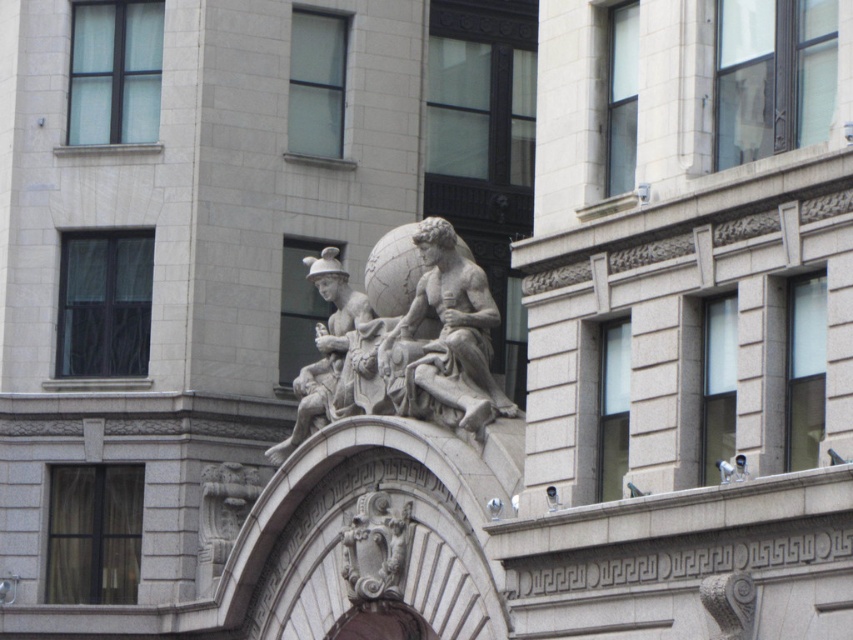
You are an architect analyzing the symmetry of the classical building. The stone statue at center is placed at coordinates. Is the statue positioned exactly at the center of the building facade?

The stone statue at center is located at coordinates point (x=438, y=328), which is very close to the exact center, so it can be considered as being positioned exactly at the center of the building facade.

You are standing in front of the classical building and want to take a photo of the stone statue at center. If your camera has a maximum zoom range of 50 meters, can you capture the statue clearly without moving closer?

The stone statue at center is 72.31 meters away from the viewer. Since the camera can only zoom up to 50 meters, you cannot capture the statue clearly without moving closer.

You are an architect designing a new building and want to incorporate two sculptures, the stone statue at center and the matte stone sculpture at center, into the facade. Based on the image, which sculpture would require more horizontal space due to its width?

The stone statue at center is wider than the matte stone sculpture at center, so it would require more horizontal space.